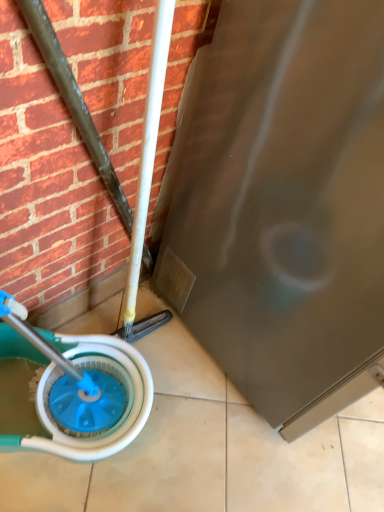
Question: Is blue plastic wheel at lower left turned away from satin silver screen door at lower right?

Choices:
 (A) no
 (B) yes

Answer: (A)

Question: From the image's perspective, is blue plastic wheel at lower left below satin silver screen door at lower right?

Choices:
 (A) yes
 (B) no

Answer: (A)

Question: Does blue plastic wheel at lower left have a greater height compared to satin silver screen door at lower right?

Choices:
 (A) no
 (B) yes

Answer: (A)

Question: Is the position of blue plastic wheel at lower left more distant than that of satin silver screen door at lower right?

Choices:
 (A) yes
 (B) no

Answer: (A)

Question: Can you confirm if blue plastic wheel at lower left is smaller than satin silver screen door at lower right?

Choices:
 (A) no
 (B) yes

Answer: (B)

Question: From the image's perspective, does blue plastic wheel at lower left appear higher than satin silver screen door at lower right?

Choices:
 (A) no
 (B) yes

Answer: (A)

Question: Can you confirm if satin silver screen door at lower right is wider than blue plastic wheel at lower left?

Choices:
 (A) no
 (B) yes

Answer: (B)

Question: From the image's perspective, would you say satin silver screen door at lower right is positioned over blue plastic wheel at lower left?

Choices:
 (A) no
 (B) yes

Answer: (B)

Question: From a real-world perspective, is satin silver screen door at lower right physically above blue plastic wheel at lower left?

Choices:
 (A) yes
 (B) no

Answer: (A)

Question: Does satin silver screen door at lower right lie behind blue plastic wheel at lower left?

Choices:
 (A) yes
 (B) no

Answer: (B)

Question: Can you confirm if satin silver screen door at lower right is positioned to the right of blue plastic wheel at lower left?

Choices:
 (A) no
 (B) yes

Answer: (B)

Question: Can you see satin silver screen door at lower right touching blue plastic wheel at lower left?

Choices:
 (A) yes
 (B) no

Answer: (B)

Question: In terms of height, does satin silver screen door at lower right look taller or shorter compared to blue plastic wheel at lower left?

Choices:
 (A) tall
 (B) short

Answer: (A)